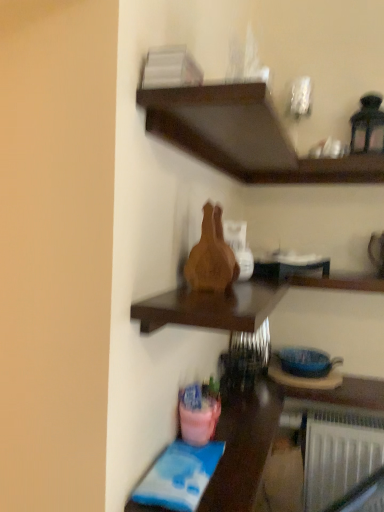
Question: Based on their positions, is dark wood shelf at upper center, marked as the first shelf in a top-to-bottom arrangement, located to the left or right of wooden vase at center, arranged as the 2th shelf when viewed from the top?

Choices:
 (A) left
 (B) right

Answer: (B)

Question: Is dark wood shelf at upper center, positioned as the second shelf in bottom-to-top order, wider or thinner than wooden vase at center, which is the 1th shelf from bottom to top?

Choices:
 (A) wide
 (B) thin

Answer: (A)

Question: Estimate the real-world distances between objects in this image. Which object is farther from the pink plastic bucket at lower left?

Choices:
 (A) wooden vase at center, which is the 1th shelf from bottom to top
 (B) dark wood shelf at upper center, marked as the first shelf in a top-to-bottom arrangement

Answer: (B)

Question: Which of these objects is positioned farthest from the wooden vase at center, which is the 1th shelf from bottom to top?

Choices:
 (A) dark wood shelf at upper center, positioned as the second shelf in bottom-to-top order
 (B) pink plastic bucket at lower left

Answer: (A)